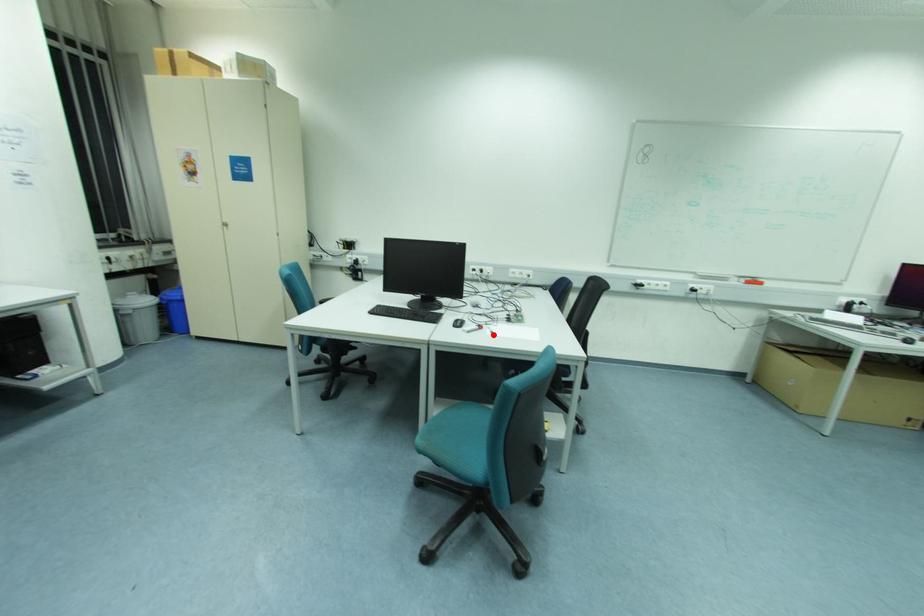
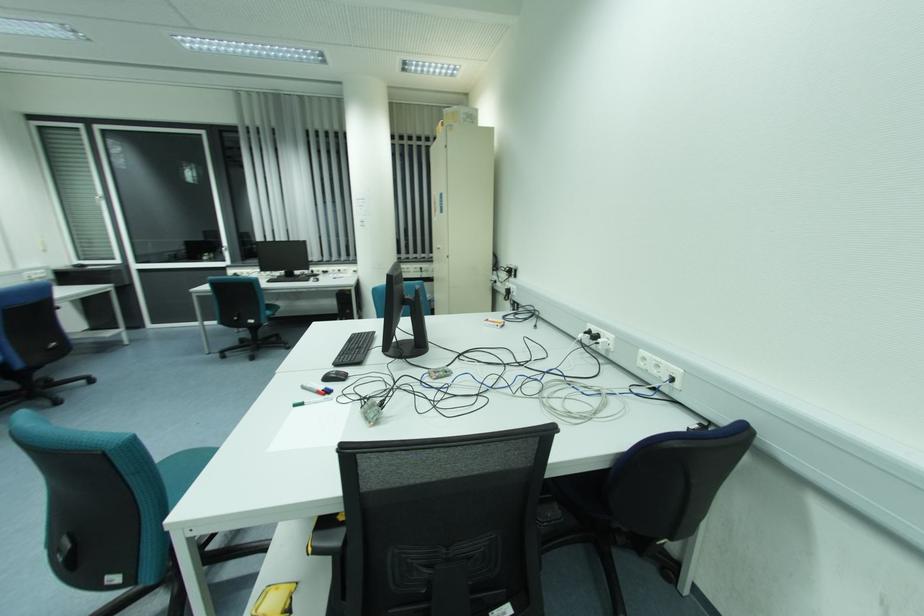
The point at the highlighted location is marked in the first image. Where is the corresponding point in the second image?

(296, 406)